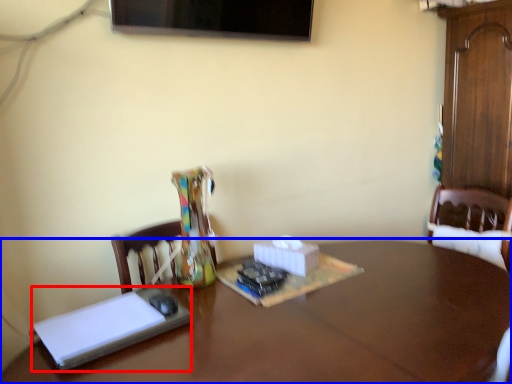
Question: Among these objects, which one is nearest to the camera, book (highlighted by a red box) or table (highlighted by a blue box)?

Choices:
 (A) book
 (B) table

Answer: (B)